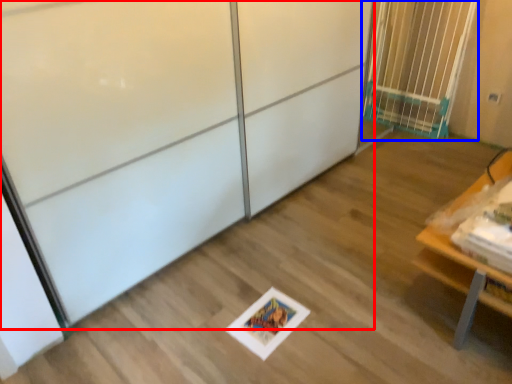
Question: Among these objects, which one is nearest to the camera, screen door (highlighted by a red box) or elevator (highlighted by a blue box)?

Choices:
 (A) screen door
 (B) elevator

Answer: (A)